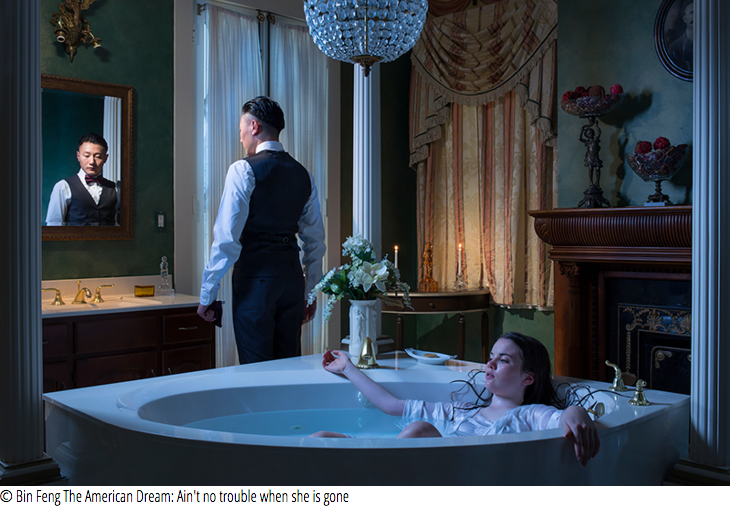
Locate an element on the screen. This screenshot has width=732, height=515. curtain is located at coordinates point(231,67), point(296,73), point(468,162).